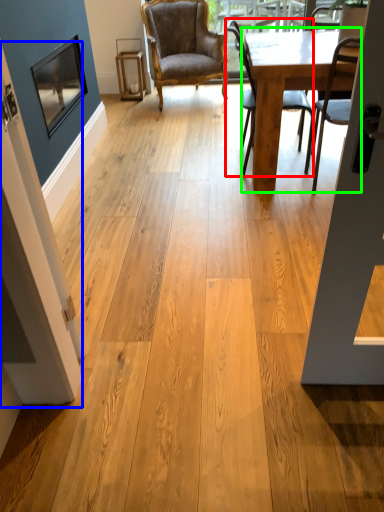
Question: Considering the real-world distances, which object is farthest from chair (highlighted by a red box)? screen door (highlighted by a blue box) or table (highlighted by a green box)?

Choices:
 (A) screen door
 (B) table

Answer: (A)